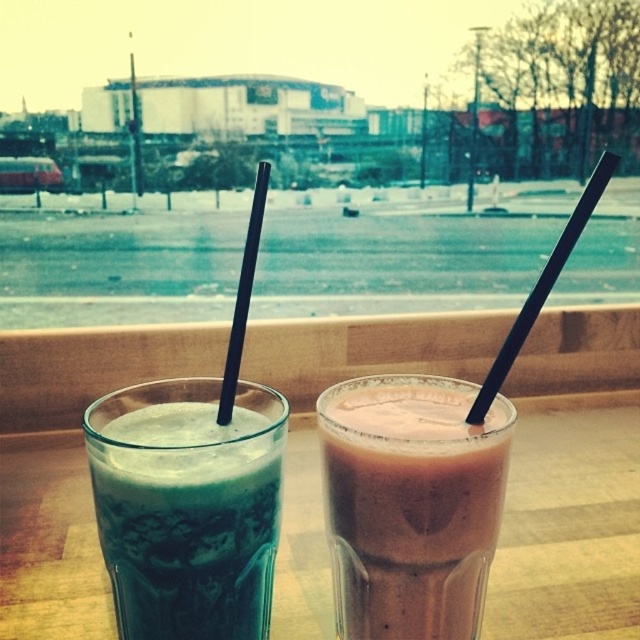
What do you see at coordinates (570, 522) in the screenshot?
I see `wooden table at center` at bounding box center [570, 522].

Is point (282, 554) farther from viewer compared to point (557, 244)?

Yes, point (282, 554) is farther from viewer.

This screenshot has height=640, width=640. In order to click on wooden table at center in this screenshot , I will do `click(570, 522)`.

Which is more to the right, green frosted glass at left or black matte straw at center?

black matte straw at center

The height and width of the screenshot is (640, 640). What do you see at coordinates (188, 525) in the screenshot? I see `green frosted glass at left` at bounding box center [188, 525].

Locate an element on the screen. green frosted glass at left is located at coordinates (188, 525).

What do you see at coordinates (188, 525) in the screenshot? This screenshot has height=640, width=640. I see `green frosted glass at left` at bounding box center [188, 525].

Is green frosted glass at left shorter than black matte straw at right?

Yes, green frosted glass at left is shorter than black matte straw at right.

Describe the element at coordinates (188, 525) in the screenshot. I see `green frosted glass at left` at that location.

What are the coordinates of `green frosted glass at left` in the screenshot? It's located at (188, 525).